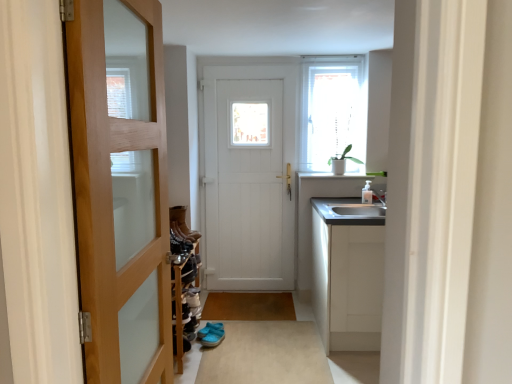
Question: Can you confirm if satin white cabinet at right is positioned to the left of wooden door at left, placed as the first door when sorted from front to back?

Choices:
 (A) no
 (B) yes

Answer: (A)

Question: Can you confirm if satin white cabinet at right is taller than wooden door at left, placed as the first door when sorted from front to back?

Choices:
 (A) no
 (B) yes

Answer: (A)

Question: Considering the relative sizes of satin white cabinet at right and wooden door at left, acting as the 2th door starting from the back, in the image provided, is satin white cabinet at right shorter than wooden door at left, acting as the 2th door starting from the back,?

Choices:
 (A) no
 (B) yes

Answer: (B)

Question: Is satin white cabinet at right positioned beyond the bounds of wooden door at left, placed as the first door when sorted from front to back?

Choices:
 (A) yes
 (B) no

Answer: (A)

Question: Is satin white cabinet at right at the right side of wooden door at left, acting as the 2th door starting from the back?

Choices:
 (A) yes
 (B) no

Answer: (A)

Question: Does satin white cabinet at right have a larger size compared to wooden door at left, placed as the first door when sorted from front to back?

Choices:
 (A) no
 (B) yes

Answer: (B)

Question: From the image's perspective, is brown matte mat at center, marked as the 1th plain in a back-to-front arrangement, under translucent glass window at upper right?

Choices:
 (A) yes
 (B) no

Answer: (A)

Question: Is brown matte mat at center, the 1th plain viewed from the top, turned away from translucent glass window at upper right?

Choices:
 (A) no
 (B) yes

Answer: (A)

Question: Does brown matte mat at center, marked as the 2th plain in a front-to-back arrangement, have a smaller size compared to translucent glass window at upper right?

Choices:
 (A) yes
 (B) no

Answer: (A)

Question: Could you tell me if brown matte mat at center, the 1th plain viewed from the top, is turned towards translucent glass window at upper right?

Choices:
 (A) yes
 (B) no

Answer: (B)

Question: Considering the relative sizes of brown matte mat at center, the second plain ordered from the bottom, and translucent glass window at upper right in the image provided, is brown matte mat at center, the second plain ordered from the bottom, bigger than translucent glass window at upper right?

Choices:
 (A) yes
 (B) no

Answer: (B)

Question: Can you confirm if brown matte mat at center, the second plain ordered from the bottom, is wider than translucent glass window at upper right?

Choices:
 (A) yes
 (B) no

Answer: (A)

Question: Is wooden door at left, placed as the first door when sorted from front to back, thinner than white wooden door at center, the second door from the front?

Choices:
 (A) no
 (B) yes

Answer: (A)